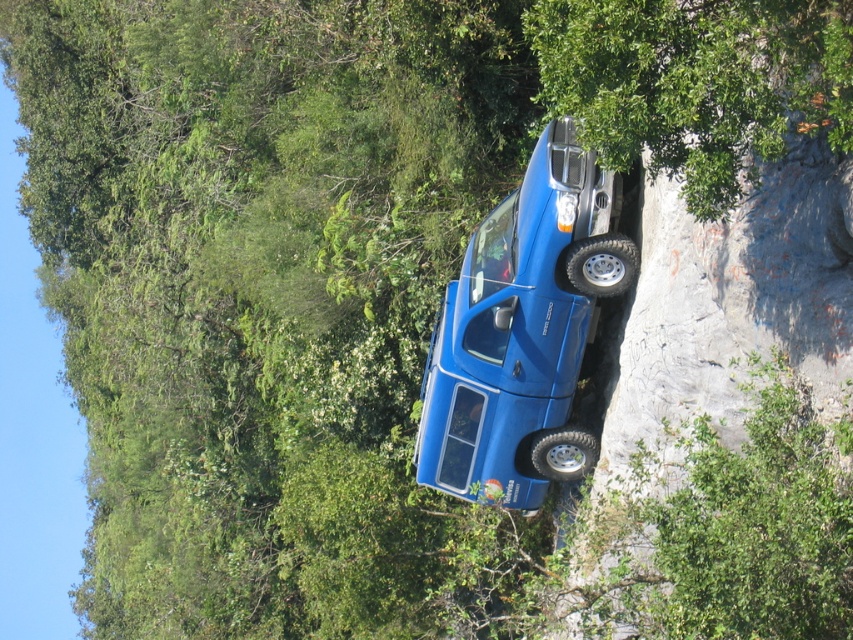
You are standing at point [630,76] and want to walk to the blue Ford pickup truck parked diagonally on the steep rocky incline. Is the point [526,205] located behind you or in front of you relative to your direction of travel towards the truck?

The point [526,205] is behind point [630,76], so it is behind you relative to your direction of travel towards the blue Ford pickup truck parked diagonally on the steep rocky incline.

You are a photographer trying to capture the matte blue jeep at center and the green leafy tree at upper right in the same frame. Based on their sizes in the image, which object would appear larger in your photo?

The matte blue jeep at center appears larger in the photo because it is taller than the green leafy tree at upper right.